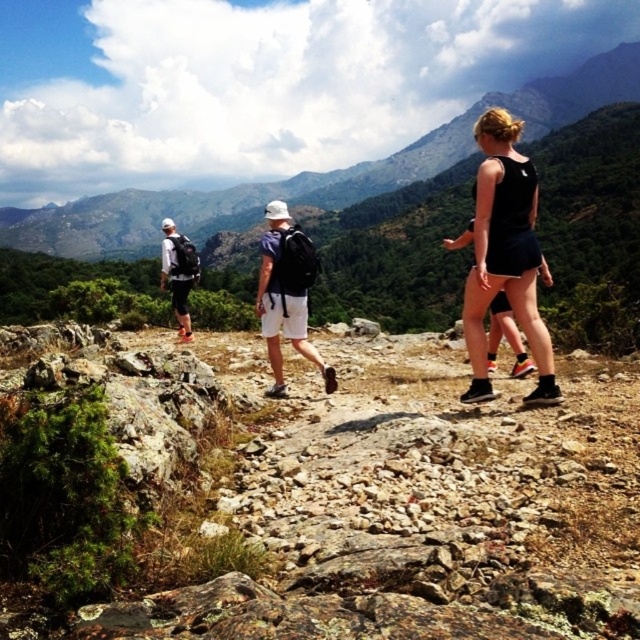
You are a hiker planning to climb the green grassy mountain at upper center. You see the white matte backpack at center on the trail. Can you estimate whether the mountain is taller than the backpack?

The green grassy mountain at upper center is taller than the white matte backpack at center, so yes, the mountain is taller than the backpack.

Looking at this image, you are a hiker trying to estimate the elevation difference between the green grassy mountain at upper center and the black matte tank top at center. Which object is taller?

The green grassy mountain at upper center is taller than the black matte tank top at center according to the description.

You are a hiker planning to take a photo of the green grassy mountain at upper center and the black matte tank top at center. Which object will appear smaller in your photo?

The black matte tank top at center will appear smaller in the photo because it is positioned behind the green grassy mountain at upper center, making it farther away from the camera and thus appearing smaller due to perspective.